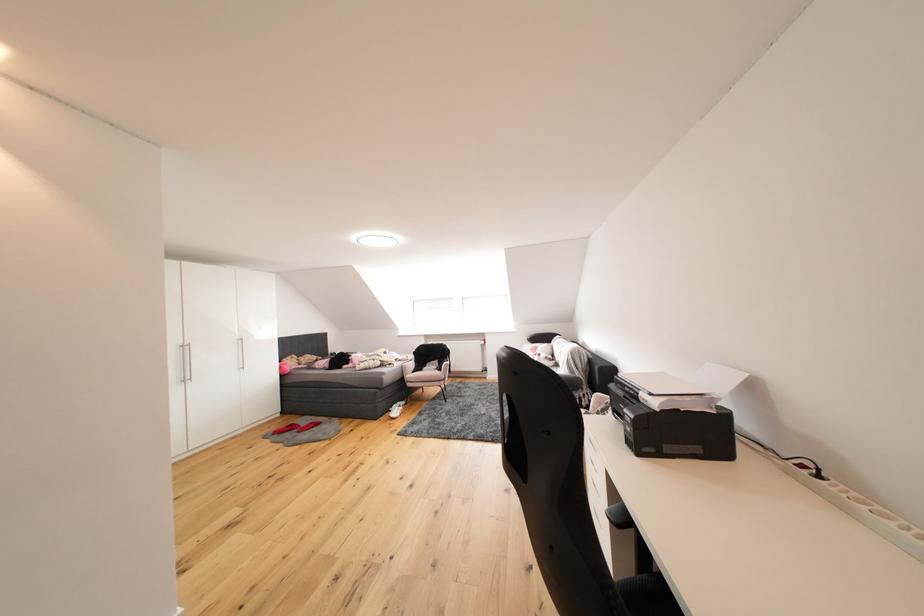
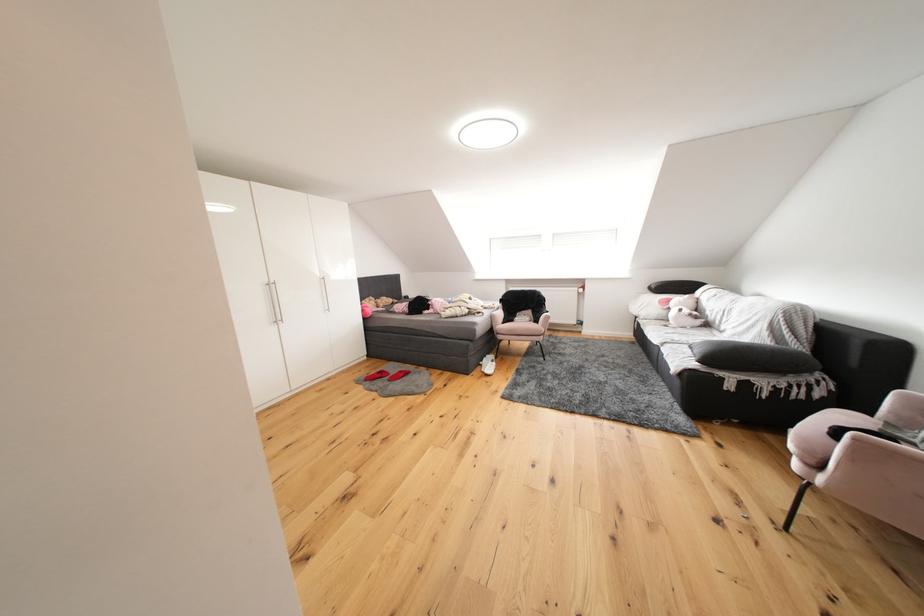
Locate, in the second image, the point that corresponds to (313,424) in the first image.

(402, 371)